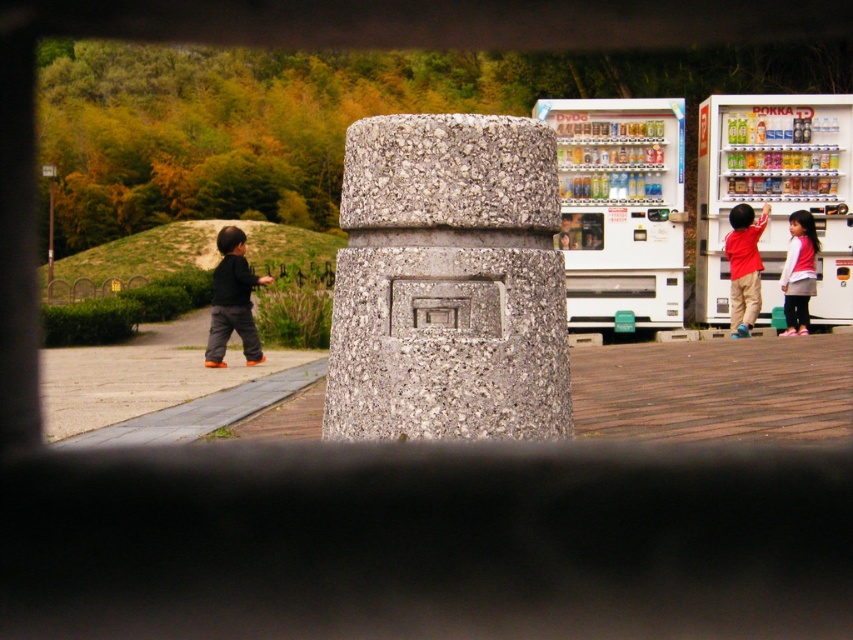
Question: Does dark gray pants at left appear on the left side of white cotton shirt at right?

Choices:
 (A) yes
 (B) no

Answer: (A)

Question: Among these points, which one is nearest to the camera?

Choices:
 (A) (426, 288)
 (B) (730, 266)
 (C) (567, 280)
 (D) (788, 193)

Answer: (A)

Question: Can you confirm if dark gray pants at left is bigger than matte red shirt at right?

Choices:
 (A) yes
 (B) no

Answer: (A)

Question: Which object appears closest to the camera in this image?

Choices:
 (A) white plastic vending machine at right
 (B) gray concrete pillar at center

Answer: (B)

Question: Estimate the real-world distances between objects in this image. Which object is closer to the dark gray pants at left?

Choices:
 (A) white cotton shirt at right
 (B) gray concrete pillar at center

Answer: (A)

Question: Does metallic white vending machine at right appear under matte red shirt at right?

Choices:
 (A) yes
 (B) no

Answer: (B)